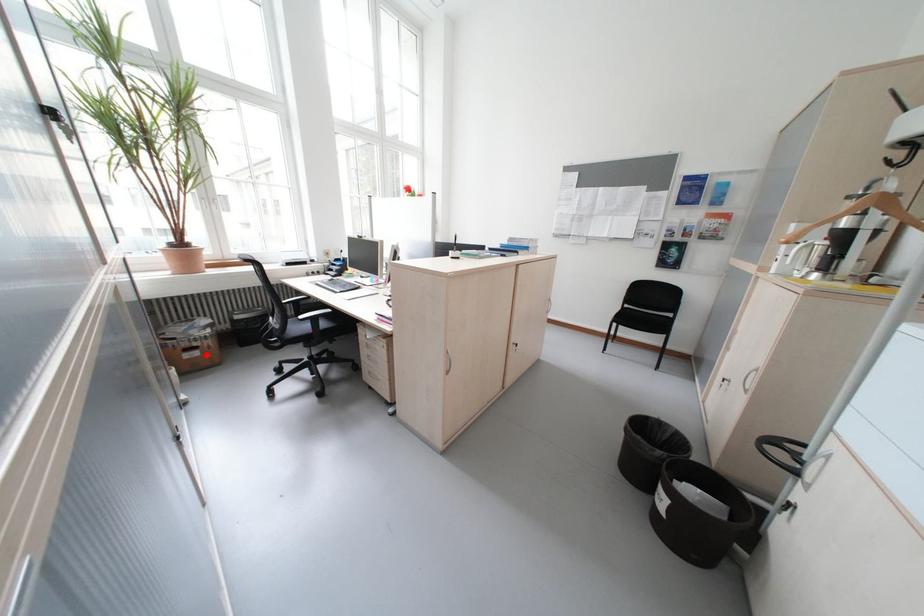
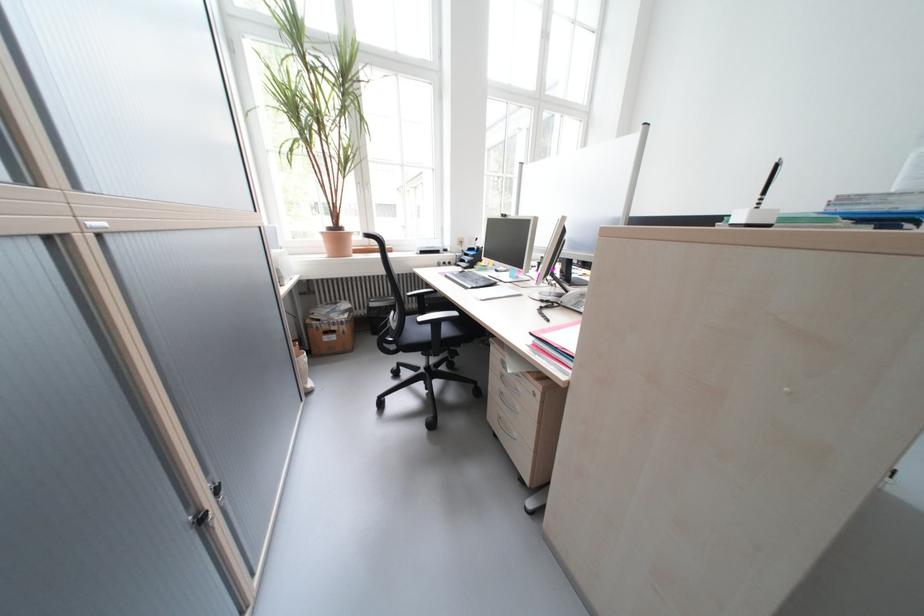
Question: I am providing you with two images of the same scene from different viewpoints. A red point is marked on the first image. Can you still see the location of the red point in image 2?

Choices:
 (A) Yes
 (B) No

Answer: (A)